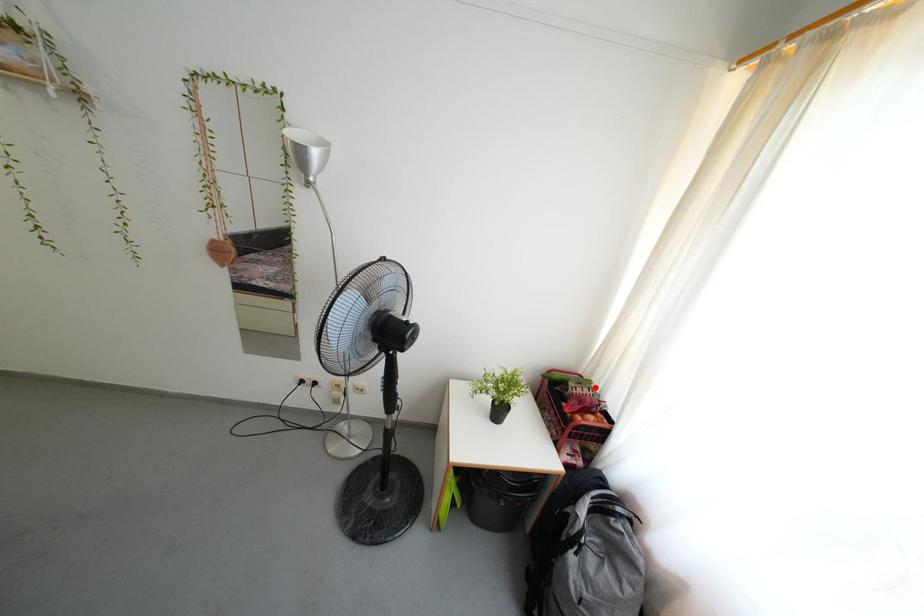
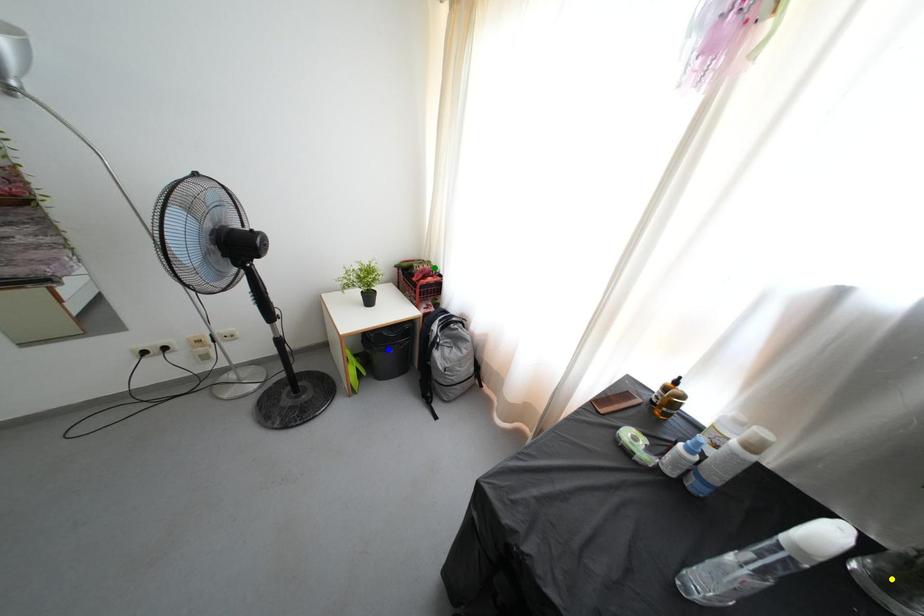
Question: I am providing you with two images of the same scene from different viewpoints. A red point is marked on the first image. You are given multiple points on the second image. Which point in image 2 represents the same 3d spot as the red point in image 1?

Choices:
 (A) blue point
 (B) yellow point
 (C) green point

Answer: (C)